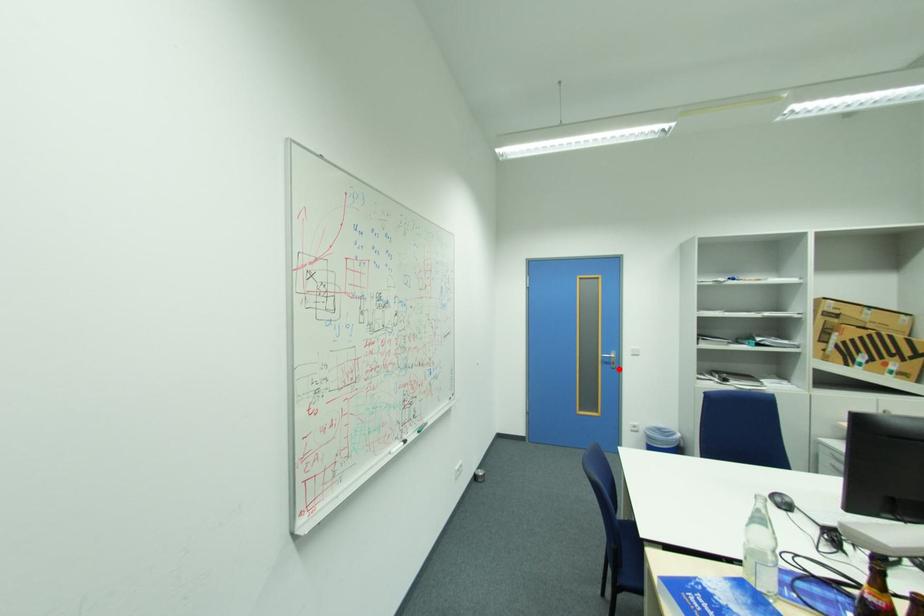
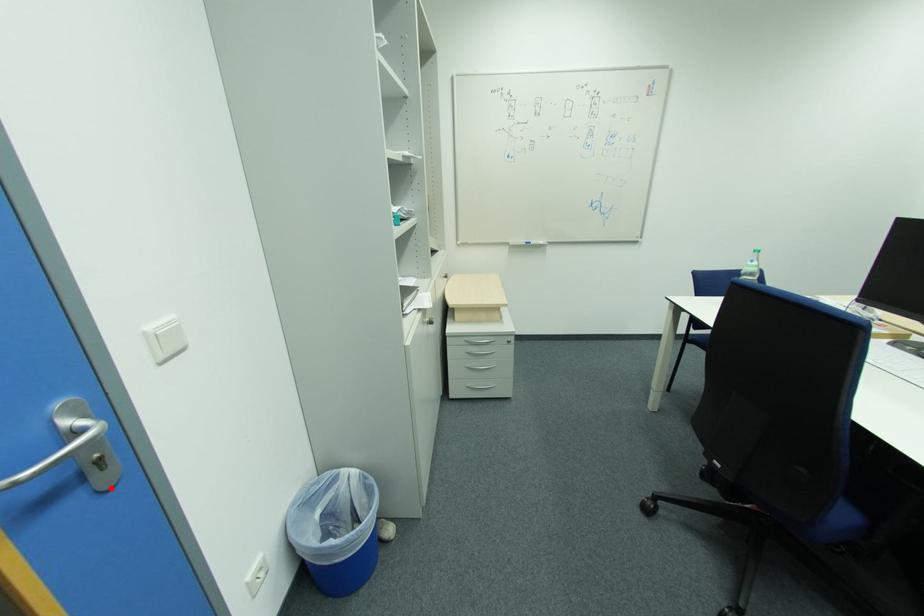
I am providing you with two images of the same scene from different viewpoints. A red point is marked on the first image and another point is marked on the second image. Is the marked point in image1 the same physical position as the marked point in image2?

Yes